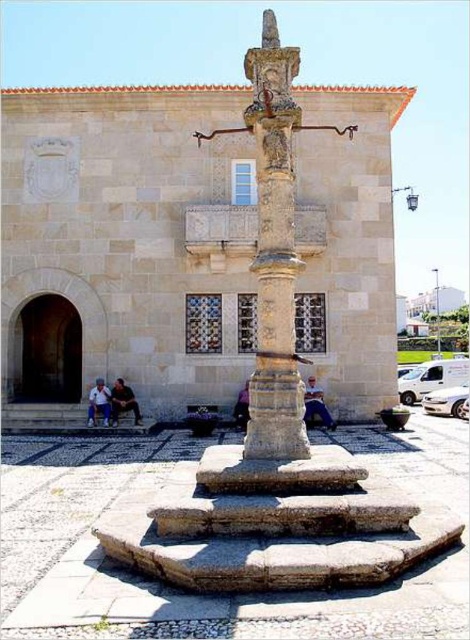
Looking at this image, does blue denim jeans at center appear on the left side of light blue denim jeans at lower left?

In fact, blue denim jeans at center is to the right of light blue denim jeans at lower left.

Can you confirm if blue denim jeans at center is smaller than light blue denim jeans at lower left?

Actually, blue denim jeans at center might be larger than light blue denim jeans at lower left.

Image resolution: width=470 pixels, height=640 pixels. Identify the location of blue denim jeans at center. (315, 404).

Find the location of a particular element. The image size is (470, 640). dark blue jeans at lower center is located at coordinates (123, 401).

Measure the distance from dark blue jeans at lower center to smooth gray pole at center.

dark blue jeans at lower center and smooth gray pole at center are 42.08 meters apart from each other.

Locate an element on the screen. dark blue jeans at lower center is located at coordinates (123, 401).

This screenshot has width=470, height=640. I want to click on dark blue jeans at lower center, so click(x=123, y=401).

Between dark blue jeans at lower center and light blue denim jeans at lower left, which one has less height?

With less height is dark blue jeans at lower center.

Is point (117, 403) more distant than point (106, 417)?

That is True.

This screenshot has height=640, width=470. I want to click on dark blue jeans at lower center, so click(123, 401).